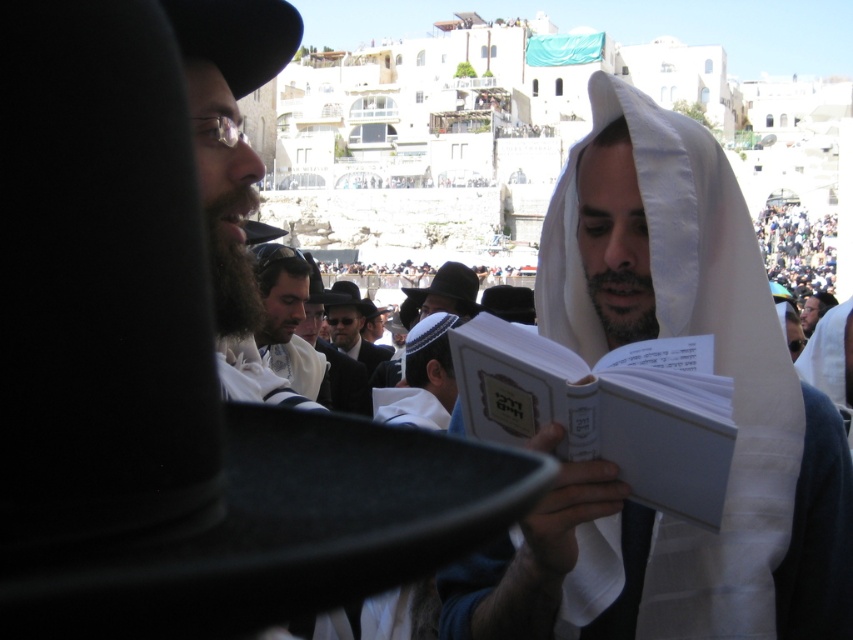
Question: Does white cloth at center lie in front of dark gray clothing at upper right?

Choices:
 (A) no
 (B) yes

Answer: (B)

Question: Which of these objects is positioned closest to the white paper book at center?

Choices:
 (A) white cloth at center
 (B) dark gray clothing at upper right
 (C) matte black suit at center

Answer: (A)

Question: Can you confirm if dark gray clothing at upper right is thinner than matte black suit at center?

Choices:
 (A) yes
 (B) no

Answer: (B)

Question: Which of the following is the farthest from the observer?

Choices:
 (A) (636, 369)
 (B) (335, 324)
 (C) (782, 268)
 (D) (660, 586)

Answer: (C)

Question: Does white cloth at center have a smaller size compared to dark gray clothing at upper right?

Choices:
 (A) yes
 (B) no

Answer: (B)

Question: Which of these objects is positioned farthest from the white paper book at center?

Choices:
 (A) white cloth at center
 (B) matte black suit at center
 (C) dark gray clothing at upper right

Answer: (C)